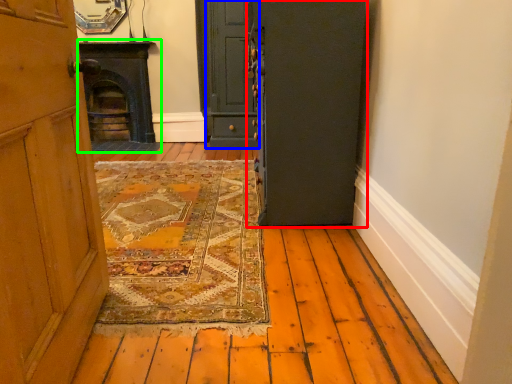
Question: Which is nearer to the door (highlighted by a red box)? door (highlighted by a blue box) or fireplace (highlighted by a green box).

Choices:
 (A) door
 (B) fireplace

Answer: (A)